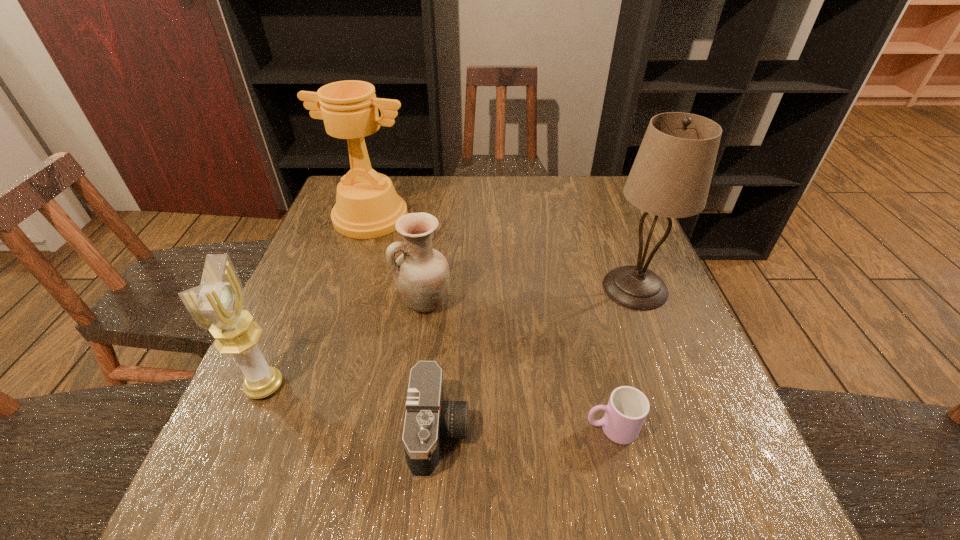
I want to click on vacant region located on the right of the taller award, so click(500, 217).

Where is `free space located 0.150m on the front-facing side of the shorter award`? The height and width of the screenshot is (540, 960). free space located 0.150m on the front-facing side of the shorter award is located at coordinates (359, 386).

This screenshot has height=540, width=960. Find the location of `vacant region located on the left of the fourth tallest object`. vacant region located on the left of the fourth tallest object is located at coordinates (312, 302).

The height and width of the screenshot is (540, 960). What are the coordinates of `vacant area located 0.240m on the front-facing side of the camera` in the screenshot? It's located at (601, 431).

Where is `free space located 0.110m with the handle on the side of the shortest object`? Image resolution: width=960 pixels, height=540 pixels. free space located 0.110m with the handle on the side of the shortest object is located at coordinates (524, 428).

Locate an element on the screen. vacant space positioned with the handle on the side of the shortest object is located at coordinates (552, 428).

You are a GUI agent. You are given a task and a screenshot of the screen. Output one action in this format:
    pyautogui.click(x=<x>, y=<y>)
    Task: Click on the vacant space located 0.120m with the handle on the side of the shortest object
    This screenshot has width=960, height=540.
    Given the screenshot: What is the action you would take?
    pyautogui.click(x=518, y=428)

Find the location of a particular element. Image resolution: width=960 pixels, height=540 pixels. object at the far edge is located at coordinates (367, 206).

I want to click on object that is at the near edge, so click(x=428, y=419).

The height and width of the screenshot is (540, 960). I want to click on object that is at the right edge, so pos(671,175).